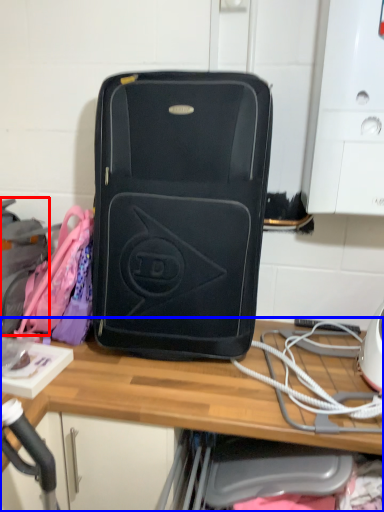
Question: Which object is closer to the camera taking this photo, luggage (highlighted by a red box) or desk (highlighted by a blue box)?

Choices:
 (A) luggage
 (B) desk

Answer: (B)